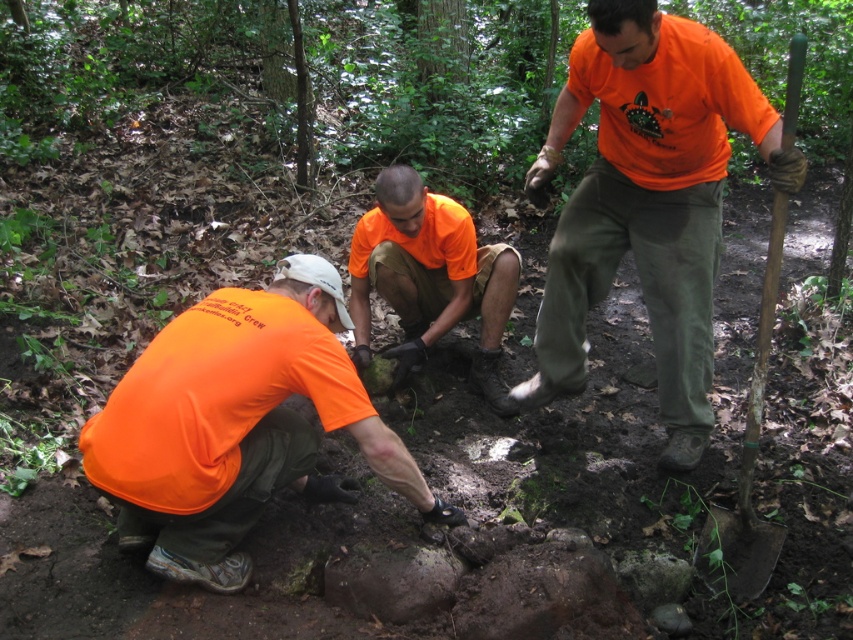
Question: Which object appears closest to the camera in this image?

Choices:
 (A) matte orange shirt at center
 (B) wooden handle shovel at right
 (C) orange matte shirt at center
 (D) matte orange shirt at lower left

Answer: (B)

Question: Which point appears closest to the camera in this image?

Choices:
 (A) (770, 552)
 (B) (492, 268)
 (C) (218, 472)

Answer: (C)

Question: Which of these objects is positioned farthest from the matte orange shirt at lower left?

Choices:
 (A) orange matte shirt at center
 (B) matte orange shirt at center

Answer: (B)

Question: Is matte orange shirt at lower left closer to the viewer compared to orange matte shirt at center?

Choices:
 (A) yes
 (B) no

Answer: (A)

Question: Can you confirm if orange matte shirt at center is thinner than wooden handle shovel at right?

Choices:
 (A) yes
 (B) no

Answer: (B)

Question: Is matte orange shirt at lower left to the right of wooden handle shovel at right from the viewer's perspective?

Choices:
 (A) no
 (B) yes

Answer: (A)